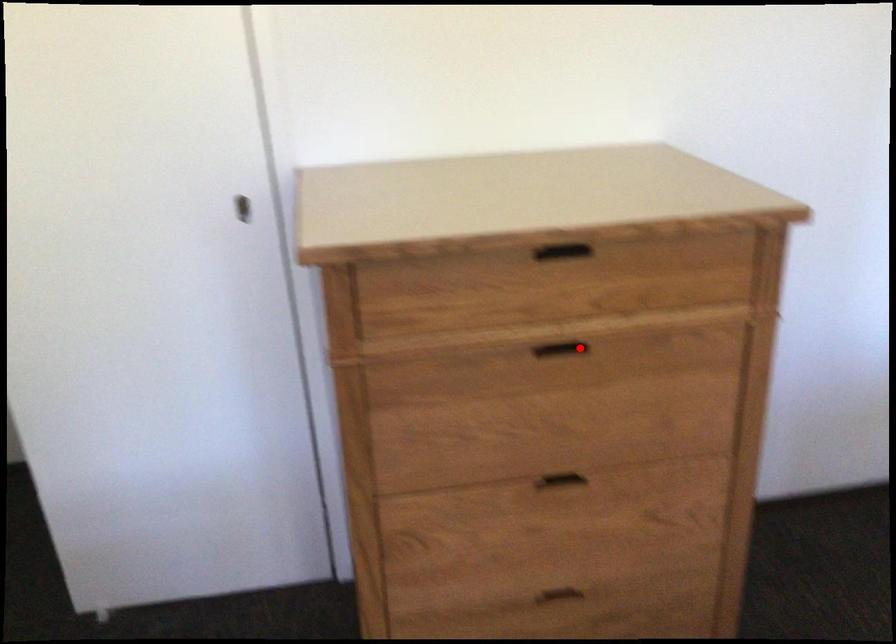
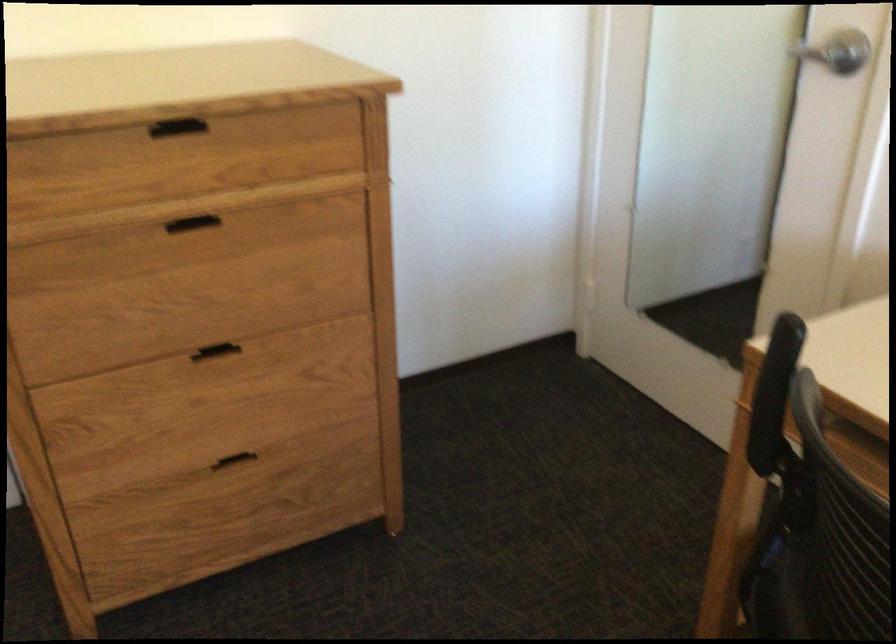
In the second image, find the point that corresponds to the highlighted location in the first image.

(211, 227)